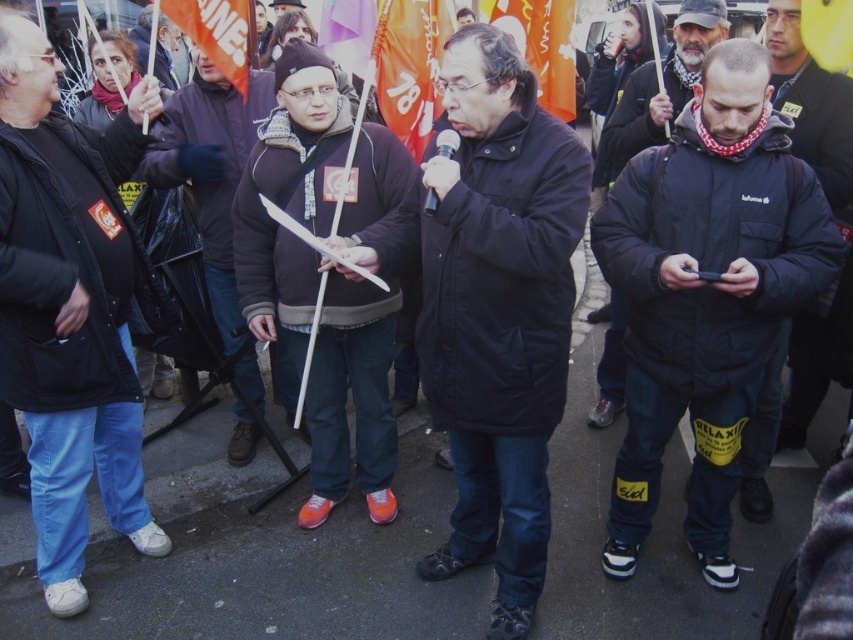
You are a photographer trying to capture a photo of the orange fabric flag at center and the black matte jacket at lower right. To ensure both are in frame, should you adjust your camera to the left or right?

The black matte jacket at lower right is to the right of the orange fabric flag at center. To include both in the frame, you should adjust your camera to the right.

You are a photographer trying to capture the speaker and the flag holder in the same frame. Given the positions of the speaker at point (595, 422) and the flag holder at point (244, 52), will you need to adjust your camera angle to include both in the shot?

Point (595, 422) is behind point (244, 52), so the speaker at point (595, 422) is further back than the flag holder at point (244, 52). To include both in the frame, you may need to adjust your camera angle to account for their different depths.